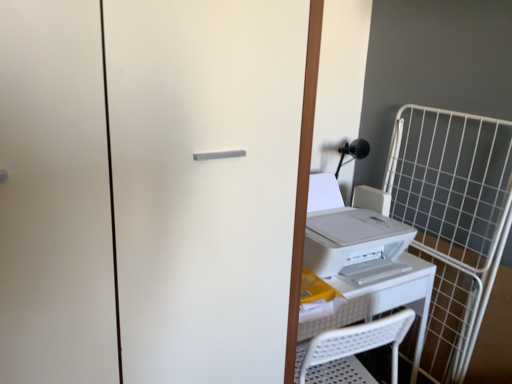
Find the location of `free space above white wire cage at right (from a real-world perspective)`. free space above white wire cage at right (from a real-world perspective) is located at coordinates (455, 245).